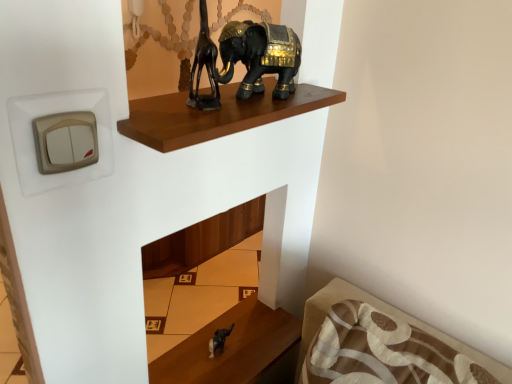
Question: Does point (249, 327) appear closer or farther from the camera than point (268, 52)?

Choices:
 (A) farther
 (B) closer

Answer: (A)

Question: From the image's perspective, relative to black glossy elephant at upper center, is satin black elephant at lower center above or below?

Choices:
 (A) above
 (B) below

Answer: (B)

Question: Estimate the real-world distances between objects in this image. Which object is closer to the brown polished wood shelf at upper center?

Choices:
 (A) black glossy elephant at upper center
 (B) satin black elephant at lower center

Answer: (A)

Question: Which of these objects is positioned closest to the satin black elephant at lower center?

Choices:
 (A) black glossy elephant at upper center
 (B) brown polished wood shelf at upper center

Answer: (B)